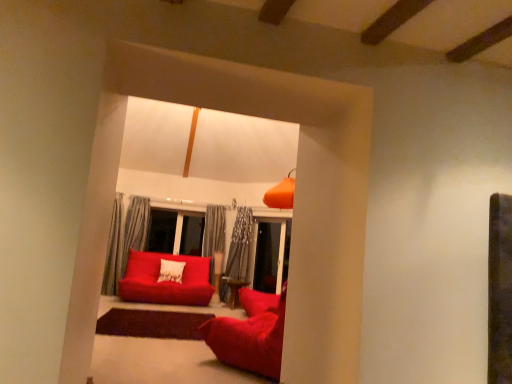
Question: Based on their positions, is matte red studio couch at center, placed as the 2th studio couch when sorted from right to left, located to the left or right of velvet red beanbag at center, arranged as the 1th studio couch when viewed from the right?

Choices:
 (A) right
 (B) left

Answer: (B)

Question: Is matte red studio couch at center, the second studio couch viewed from the front, in front of or behind velvet red beanbag at center, which ranks as the 2th studio couch in left-to-right order, in the image?

Choices:
 (A) front
 (B) behind

Answer: (B)

Question: From a real-world perspective, is matte red studio couch at center, placed as the 2th studio couch when sorted from right to left, physically located above or below velvet red beanbag at center, acting as the first studio couch starting from the front?

Choices:
 (A) above
 (B) below

Answer: (A)

Question: Based on their positions, is velvet red beanbag at center, arranged as the 1th studio couch when viewed from the right, located to the left or right of matte red studio couch at center, the second studio couch viewed from the front?

Choices:
 (A) right
 (B) left

Answer: (A)

Question: Is velvet red beanbag at center, acting as the first studio couch starting from the front, in front of or behind matte red studio couch at center, the second studio couch viewed from the front, in the image?

Choices:
 (A) behind
 (B) front

Answer: (B)

Question: From the image's perspective, relative to matte red studio couch at center, the second studio couch viewed from the front, is velvet red beanbag at center, acting as the first studio couch starting from the front, above or below?

Choices:
 (A) below
 (B) above

Answer: (B)

Question: Is velvet red beanbag at center, arranged as the 2th studio couch when viewed from the back, bigger or smaller than matte red studio couch at center, placed as the 2th studio couch when sorted from right to left?

Choices:
 (A) small
 (B) big

Answer: (A)